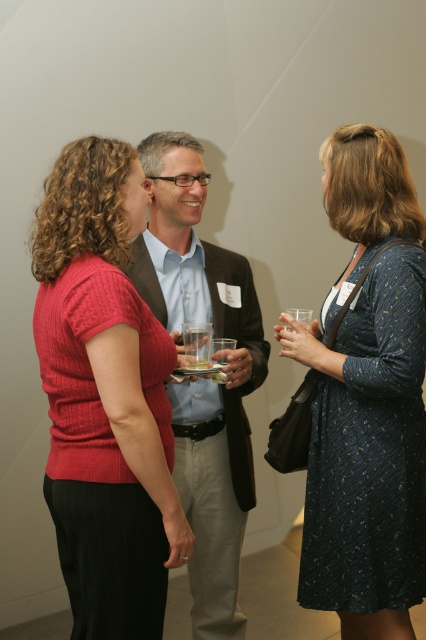
You are at a networking event and need to hand a business card to both the matte red sweater at left and the matte black suit at center. Based on their heights, which person will require you to adjust your posture to reach them?

The matte red sweater at left is shorter than the matte black suit at center, so you will need to adjust your posture to reach the matte red sweater at left.

You are a photographer at a formal event and need to capture a clear photo of the matte black suit at center without the clear glass at center obstructing the view. Based on their positions, is this possible?

The clear glass at center is behind the matte black suit at center, so it won not block the view of the matte black suit at center. Therefore, you can take a clear photo of the matte black suit at center without obstruction from the clear glass at center.